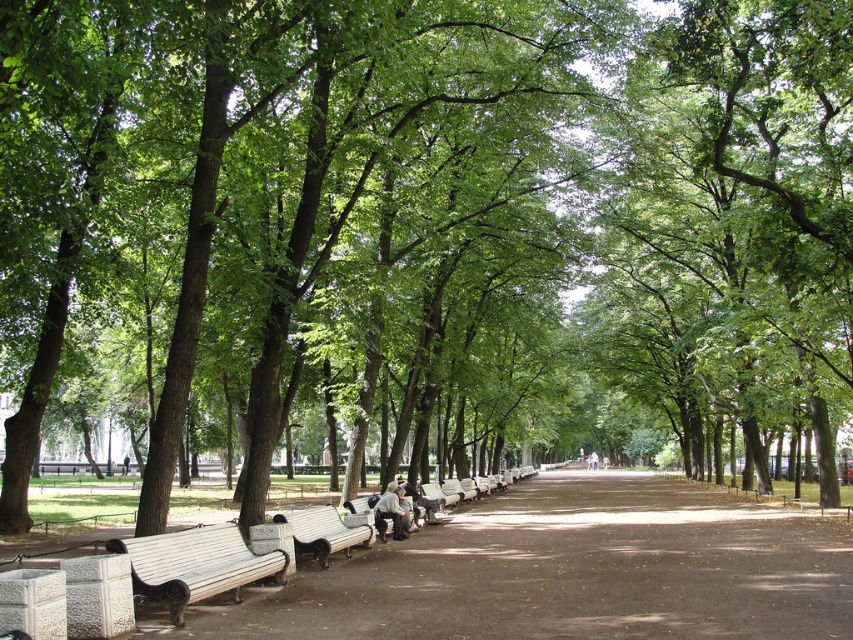
Question: Does wooden bench at lower left come in front of wooden bench at center?

Choices:
 (A) yes
 (B) no

Answer: (A)

Question: Which object appears closest to the camera in this image?

Choices:
 (A) wooden bench at lower left
 (B) wooden bench at center

Answer: (A)

Question: Which point is farther to the camera?

Choices:
 (A) wooden bench at center
 (B) wooden bench at lower left

Answer: (A)

Question: Which object is farther from the camera taking this photo?

Choices:
 (A) wooden bench at center
 (B) wooden bench at lower left

Answer: (A)

Question: Can you confirm if wooden bench at lower left is wider than wooden bench at center?

Choices:
 (A) no
 (B) yes

Answer: (A)

Question: Is wooden bench at lower left bigger than wooden bench at center?

Choices:
 (A) yes
 (B) no

Answer: (A)